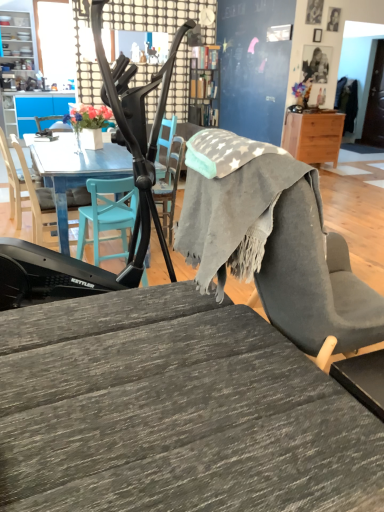
What do you see at coordinates (13, 183) in the screenshot? The image size is (384, 512). I see `teal wooden chair at left, the first chair in the left-to-right sequence` at bounding box center [13, 183].

Based on the photo, in order to face wooden desk at center, the 2th desk in the top-to-bottom sequence, should I rotate leftwards or rightwards?

Turn left by 4.914 degrees to look at wooden desk at center, the 2th desk in the top-to-bottom sequence.

What are the coordinates of `wooden desk at center, the 2th desk in the top-to-bottom sequence` in the screenshot? It's located at (174, 411).

This screenshot has height=512, width=384. What do you see at coordinates (314, 12) in the screenshot?
I see `wooden picture frame at upper right, the 2th picture frame positioned from the bottom` at bounding box center [314, 12].

What are the coordinates of `matte black photo frame at upper right, positioned as the 1th person in bottom-to-top order` in the screenshot? It's located at (315, 65).

Is matte black picture frame at upper center, placed as the 1th picture frame when sorted from bottom to top, far away from wooden picture frame at upper right, the 2th picture frame in the back-to-front sequence?

They are positioned close to each other.

Which is behind, point (319, 39) or point (308, 7)?

The point (319, 39) is more distant.

Considering the relative sizes of matte black picture frame at upper center, acting as the second picture frame starting from the front, and wooden picture frame at upper right, the 2th picture frame in the back-to-front sequence, in the image provided, is matte black picture frame at upper center, acting as the second picture frame starting from the front, wider than wooden picture frame at upper right, the 2th picture frame in the back-to-front sequence,?

Yes, matte black picture frame at upper center, acting as the second picture frame starting from the front, is wider than wooden picture frame at upper right, the 2th picture frame in the back-to-front sequence.

Is matte black picture frame at upper center, which is the first picture frame from back to front, in front of or behind wooden picture frame at upper right, placed as the 1th picture frame when sorted from front to back, in the image?

Clearly, matte black picture frame at upper center, which is the first picture frame from back to front, is behind wooden picture frame at upper right, placed as the 1th picture frame when sorted from front to back.

From a real-world perspective, which object stands above the other?

gray fleece blanket at center.

Can you tell me how much teal wood chair at left, the 2th chair positioned from the right, and gray fleece blanket at center differ in facing direction?

8.93 degrees separate the facing orientations of teal wood chair at left, the 2th chair positioned from the right, and gray fleece blanket at center.

From the image's perspective, relative to gray fleece blanket at center, is teal wood chair at left, the 2th chair positioned from the right, above or below?

Clearly, from the image's perspective, teal wood chair at left, the 2th chair positioned from the right, is above gray fleece blanket at center.

Is teal wood chair at left, arranged as the second chair when viewed from the left, located outside gray fleece blanket at center?

Yes, teal wood chair at left, arranged as the second chair when viewed from the left, is not within gray fleece blanket at center.

Where is `houseplant below the smooth black portrait at upper right, the first person positioned from the top (from a real-world perspective)`? This screenshot has width=384, height=512. houseplant below the smooth black portrait at upper right, the first person positioned from the top (from a real-world perspective) is located at coordinates (89, 124).

Considering the positions of objects smooth black portrait at upper right, the first person positioned from the top, and matte white vase at upper left in the image provided, who is more to the right, smooth black portrait at upper right, the first person positioned from the top, or matte white vase at upper left?

From the viewer's perspective, smooth black portrait at upper right, the first person positioned from the top, appears more on the right side.

What's the angular difference between smooth black portrait at upper right, the first person positioned from the top, and matte white vase at upper left's facing directions?

They differ by 131 degrees in their facing directions.

From the image's perspective, between smooth black portrait at upper right, the first person positioned from the top, and matte white vase at upper left, who is located below?

matte white vase at upper left.

You are a GUI agent. You are given a task and a screenshot of the screen. Output one action in this format:
    pyautogui.click(x=<x>, y=<y>)
    Task: Click on the chair that is the 1st one when counting leftward from the matte black chair at center, the 1th chair when ordered from right to left
    
    Given the screenshot: What is the action you would take?
    pyautogui.click(x=37, y=199)

In the scene shown: What's the angular difference between teal wood chair at left, arranged as the second chair when viewed from the left, and matte black chair at center, the 1th chair when ordered from right to left,'s facing directions?

There is a 92.3-degree angle between the facing directions of teal wood chair at left, arranged as the second chair when viewed from the left, and matte black chair at center, the 1th chair when ordered from right to left.

Would you consider teal wood chair at left, arranged as the second chair when viewed from the left, to be distant from matte black chair at center, marked as the 3th chair in a left-to-right arrangement?

No, there isn't a large distance between teal wood chair at left, arranged as the second chair when viewed from the left, and matte black chair at center, marked as the 3th chair in a left-to-right arrangement.

Based on the photo, could you measure the distance between teal wood chair at left, arranged as the second chair when viewed from the left, and matte black chair at center, the 1th chair when ordered from right to left?

The distance of teal wood chair at left, arranged as the second chair when viewed from the left, from matte black chair at center, the 1th chair when ordered from right to left, is 15.16 inches.

Could you tell me if smooth black portrait at upper right, the second person when ordered from bottom to top, is turned towards teal wood chair at left, arranged as the second chair when viewed from the left?

No, smooth black portrait at upper right, the second person when ordered from bottom to top, is not oriented towards teal wood chair at left, arranged as the second chair when viewed from the left.

Which person is the 2nd one when counting from the right side of the teal wood chair at left, the 2th chair positioned from the right? Please provide its 2D coordinates.

[(333, 19)]

From a real-world perspective, who is located higher, smooth black portrait at upper right, the second person when ordered from bottom to top, or teal wood chair at left, arranged as the second chair when viewed from the left?

In real-world perspective, smooth black portrait at upper right, the second person when ordered from bottom to top, is above.

Is smooth black portrait at upper right, the second person when ordered from bottom to top, at the right side of teal wood chair at left, arranged as the second chair when viewed from the left?

Correct, you'll find smooth black portrait at upper right, the second person when ordered from bottom to top, to the right of teal wood chair at left, arranged as the second chair when viewed from the left.

Who is bigger, matte white vase at upper left or teal wooden chair at left, the third chair viewed from the right?

teal wooden chair at left, the third chair viewed from the right.

Is matte white vase at upper left not within teal wooden chair at left, the first chair in the left-to-right sequence?

Yes.

Looking at this image, how distant is matte white vase at upper left from teal wooden chair at left, the first chair in the left-to-right sequence?

matte white vase at upper left is 34.40 inches away from teal wooden chair at left, the first chair in the left-to-right sequence.

Are matte black picture frame at upper center, placed as the 1th picture frame when sorted from bottom to top, and teal wood chair at left, arranged as the second chair when viewed from the left, making contact?

No, matte black picture frame at upper center, placed as the 1th picture frame when sorted from bottom to top, is not with teal wood chair at left, arranged as the second chair when viewed from the left.

Considering the sizes of objects matte black picture frame at upper center, which is the first picture frame from back to front, and teal wood chair at left, the 2th chair positioned from the right, in the image provided, who is smaller, matte black picture frame at upper center, which is the first picture frame from back to front, or teal wood chair at left, the 2th chair positioned from the right,?

Smaller between the two is matte black picture frame at upper center, which is the first picture frame from back to front.

Considering the positions of objects matte black picture frame at upper center, which is the first picture frame from back to front, and teal wood chair at left, arranged as the second chair when viewed from the left, in the image provided, who is more to the right, matte black picture frame at upper center, which is the first picture frame from back to front, or teal wood chair at left, arranged as the second chair when viewed from the left,?

From the viewer's perspective, matte black picture frame at upper center, which is the first picture frame from back to front, appears more on the right side.

Image resolution: width=384 pixels, height=512 pixels. What are the coordinates of `picture frame positioned vertically above the matte black picture frame at upper center, placed as the 1th picture frame when sorted from bottom to top (from a real-world perspective)` in the screenshot? It's located at (314, 12).

Image resolution: width=384 pixels, height=512 pixels. I want to click on the 2nd chair located beneath the gray fleece blanket at center (from a real-world perspective), so click(37, 199).

Which object lies nearer to the anchor point matte black chair at center, marked as the 3th chair in a left-to-right arrangement, matte black baby carriage at center or teal wooden chair at left, the third chair viewed from the right?

matte black baby carriage at center is positioned closer to the anchor matte black chair at center, marked as the 3th chair in a left-to-right arrangement.

When comparing their distances from matte black picture frame at upper center, placed as the 1th picture frame when sorted from bottom to top, does gray fleece blanket at center or matte black baby carriage at center seem closer?

The object closer to matte black picture frame at upper center, placed as the 1th picture frame when sorted from bottom to top, is matte black baby carriage at center.

Which object lies nearer to the anchor point matte black picture frame at upper center, placed as the 1th picture frame when sorted from bottom to top, teal wooden chair at left, the first chair in the left-to-right sequence, or wooden desk at center, the 2th desk in the top-to-bottom sequence?

teal wooden chair at left, the first chair in the left-to-right sequence, lies closer to matte black picture frame at upper center, placed as the 1th picture frame when sorted from bottom to top, than the other object.

When comparing their distances from wooden desk at right, which ranks as the 1th desk in right-to-left order, does matte black photo frame at upper right, positioned as the 1th person in bottom-to-top order, or wooden picture frame at upper right, the 2th picture frame in the back-to-front sequence, seem closer?

matte black photo frame at upper right, positioned as the 1th person in bottom-to-top order, lies closer to wooden desk at right, which ranks as the 1th desk in right-to-left order, than the other object.

When comparing their distances from smooth black portrait at upper right, the second person when ordered from bottom to top, does matte black photo frame at upper right, positioned as the 1th person in bottom-to-top order, or wooden desk at center, marked as the 1th desk in a left-to-right arrangement, seem further?

Based on the image, wooden desk at center, marked as the 1th desk in a left-to-right arrangement, appears to be further to smooth black portrait at upper right, the second person when ordered from bottom to top.

From the image, which object appears to be farther from matte black chair at center, marked as the 3th chair in a left-to-right arrangement, wooden desk at center, marked as the 1th desk in a left-to-right arrangement, or teal wood chair at left, the 2th chair positioned from the right?

wooden desk at center, marked as the 1th desk in a left-to-right arrangement.

Considering their positions, is matte black baby carriage at center positioned further to wooden picture frame at upper right, the 2th picture frame positioned from the bottom, than matte black picture frame at upper center, the 2th picture frame positioned from the top?

matte black baby carriage at center is further to wooden picture frame at upper right, the 2th picture frame positioned from the bottom.

Looking at this image, based on their spatial positions, is matte black baby carriage at center or matte white vase at upper left closer to smooth black portrait at upper right, the second person when ordered from bottom to top?

matte white vase at upper left.

Where is `chair between teal wood chair at left, the 2th chair positioned from the right, and matte black picture frame at upper center, placed as the 1th picture frame when sorted from bottom to top, from front to back`? Image resolution: width=384 pixels, height=512 pixels. chair between teal wood chair at left, the 2th chair positioned from the right, and matte black picture frame at upper center, placed as the 1th picture frame when sorted from bottom to top, from front to back is located at coordinates (13, 183).

This screenshot has height=512, width=384. I want to click on baby carriage located between wooden desk at center, the 2th desk in the top-to-bottom sequence, and wooden desk at right, which is counted as the second desk, starting from the left, in the depth direction, so click(138, 204).

You are a GUI agent. You are given a task and a screenshot of the screen. Output one action in this format:
    pyautogui.click(x=<x>, y=<y>)
    Task: Click on the person located between wooden desk at center, acting as the 1th desk starting from the bottom, and matte black picture frame at upper center, acting as the second picture frame starting from the front, in the depth direction
    This screenshot has width=384, height=512.
    Given the screenshot: What is the action you would take?
    333,19

This screenshot has width=384, height=512. Find the location of `houseplant located between teal wooden chair at left, the first chair in the left-to-right sequence, and matte black photo frame at upper right, positioned as the 1th person in bottom-to-top order, in the left-right direction`. houseplant located between teal wooden chair at left, the first chair in the left-to-right sequence, and matte black photo frame at upper right, positioned as the 1th person in bottom-to-top order, in the left-right direction is located at coordinates (89, 124).